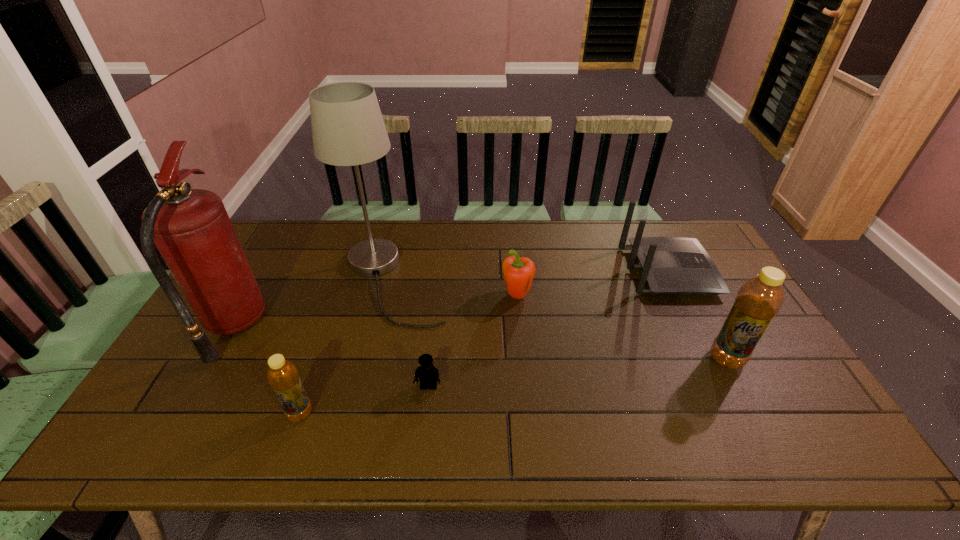
To achieve even spacing by inserting another bottle among them, please point to a vacant spot for this new bottle. Please provide its 2D coordinates. Your answer should be formatted as a tuple, i.e. [(x, y)], where the tuple contains the x and y coordinates of a point satisfying the conditions above.

[(525, 384)]